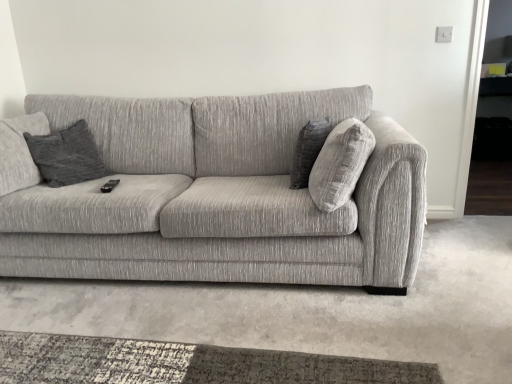
The height and width of the screenshot is (384, 512). Describe the element at coordinates (216, 193) in the screenshot. I see `textured gray couch at center` at that location.

Where is `textured gray couch at center`? This screenshot has width=512, height=384. textured gray couch at center is located at coordinates (216, 193).

What is the approximate width of dark gray textured pillow at center?

It is 20.43 centimeters.

The width and height of the screenshot is (512, 384). Identify the location of dark gray textured pillow at center. (308, 150).

Measure the distance between point (324, 127) and camera.

1.95 meters.

The height and width of the screenshot is (384, 512). What do you see at coordinates (308, 150) in the screenshot?
I see `dark gray textured pillow at center` at bounding box center [308, 150].

Locate an element on the screen. This screenshot has width=512, height=384. textured gray couch at center is located at coordinates (216, 193).

Considering the positions of objects textured gray couch at center and dark gray textured pillow at center in the image provided, who is more to the right, textured gray couch at center or dark gray textured pillow at center?

dark gray textured pillow at center.

Based on the photo, which is in front, textured gray couch at center or dark gray textured pillow at center?

textured gray couch at center.

Does point (381, 211) appear closer or farther from the camera than point (328, 130)?

Point (381, 211) appears to be closer to the viewer than point (328, 130).

From the image's perspective, which one is positioned higher, textured gray couch at center or dark gray textured pillow at center?

From the image's view, dark gray textured pillow at center is above.

Consider the image. From a real-world perspective, is textured gray couch at center positioned above or below dark gray textured pillow at center?

Clearly, from a real-world perspective, textured gray couch at center is below dark gray textured pillow at center.

Considering the sizes of objects textured gray couch at center and dark gray textured pillow at center in the image provided, who is thinner, textured gray couch at center or dark gray textured pillow at center?

dark gray textured pillow at center is thinner.

Considering the relative sizes of textured gray couch at center and dark gray textured pillow at center in the image provided, is textured gray couch at center taller than dark gray textured pillow at center?

Yes, textured gray couch at center is taller than dark gray textured pillow at center.

Which of these two, textured gray couch at center or dark gray textured pillow at center, is bigger?

Bigger between the two is textured gray couch at center.

Choose the correct answer: Is textured gray couch at center inside dark gray textured pillow at center or outside it?

textured gray couch at center is outside dark gray textured pillow at center.

Would you say textured gray couch at center is a long distance from dark gray textured pillow at center?

No, textured gray couch at center is not far away from dark gray textured pillow at center.

Is textured gray couch at center oriented away from dark gray textured pillow at center?

Yes.

What are the coordinates of `pillow that is on the right side of textured gray couch at center` in the screenshot? It's located at (308, 150).

Which object is positioned more to the left, dark gray textured pillow at center or textured gray couch at center?

textured gray couch at center.

Does dark gray textured pillow at center lie behind textured gray couch at center?

Yes, dark gray textured pillow at center is behind textured gray couch at center.

Does point (332, 126) appear closer or farther from the camera than point (64, 224)?

Point (332, 126) appears to be closer to the viewer than point (64, 224).

From the image's perspective, which one is positioned lower, dark gray textured pillow at center or textured gray couch at center?

textured gray couch at center, from the image's perspective.

From a real-world perspective, which is physically above, dark gray textured pillow at center or textured gray couch at center?

dark gray textured pillow at center is physically above.

Does dark gray textured pillow at center have a greater width compared to textured gray couch at center?

In fact, dark gray textured pillow at center might be narrower than textured gray couch at center.

Which of these two, dark gray textured pillow at center or textured gray couch at center, stands taller?

textured gray couch at center.

Between dark gray textured pillow at center and textured gray couch at center, which one has larger size?

With larger size is textured gray couch at center.

Is dark gray textured pillow at center not within textured gray couch at center?

No.

Can you see dark gray textured pillow at center touching textured gray couch at center?

No, dark gray textured pillow at center is not touching textured gray couch at center.

Could you tell me if dark gray textured pillow at center is facing textured gray couch at center?

Yes, dark gray textured pillow at center is facing textured gray couch at center.

In the scene shown: Can you tell me how much dark gray textured pillow at center and textured gray couch at center differ in facing direction?

There is a 104-degree angle between the facing directions of dark gray textured pillow at center and textured gray couch at center.

The height and width of the screenshot is (384, 512). What are the coordinates of `studio couch that is below the dark gray textured pillow at center (from the image's perspective)` in the screenshot? It's located at (216, 193).

Locate an element on the screen. The image size is (512, 384). pillow lying on the right of textured gray couch at center is located at coordinates (308, 150).

Where is `pillow above the textured gray couch at center (from the image's perspective)`? The image size is (512, 384). pillow above the textured gray couch at center (from the image's perspective) is located at coordinates (308, 150).